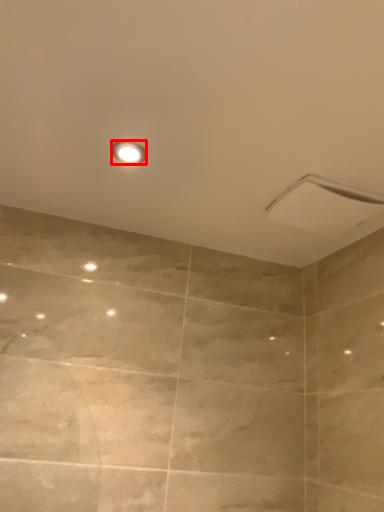
Question: From the image's perspective, where is light fixture (annotated by the red box) located in relation to shower in the image?

Choices:
 (A) below
 (B) above

Answer: (B)